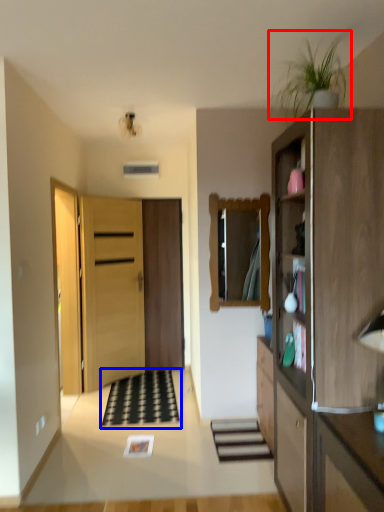
Question: Which of the following is the closest to the observer, plant (highlighted by a red box) or doormat (highlighted by a blue box)?

Choices:
 (A) plant
 (B) doormat

Answer: (A)